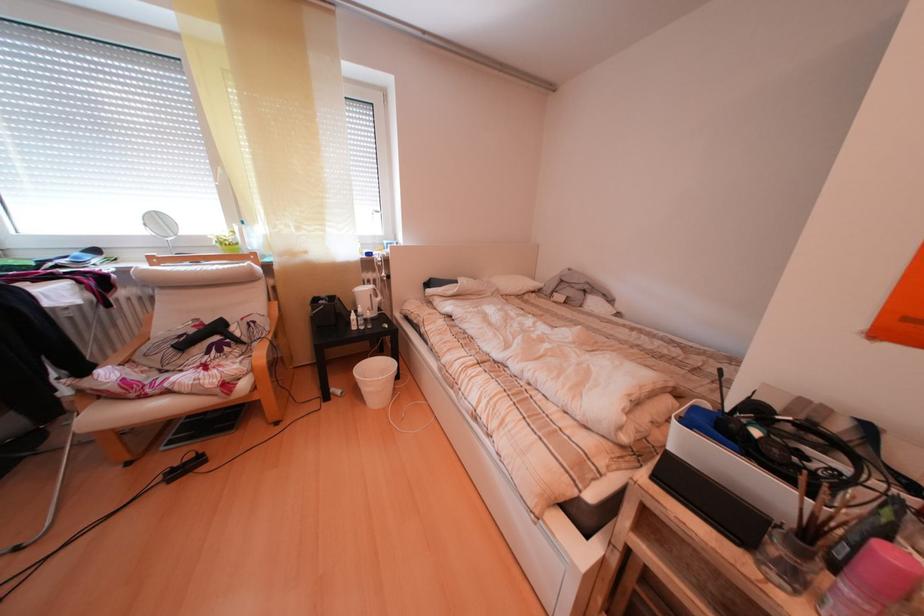
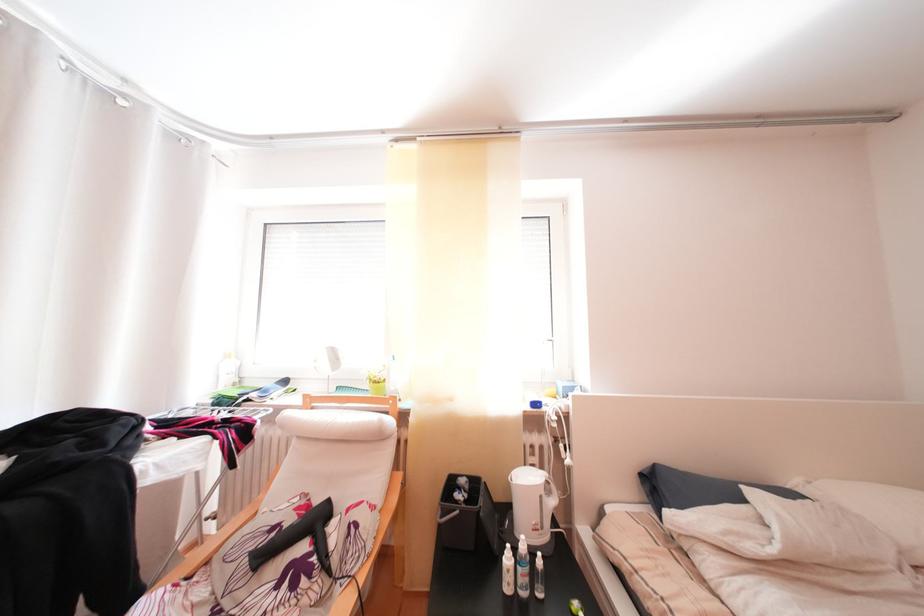
Find the pixel in the second image that matches pixel 360 328 in the first image.

(509, 565)